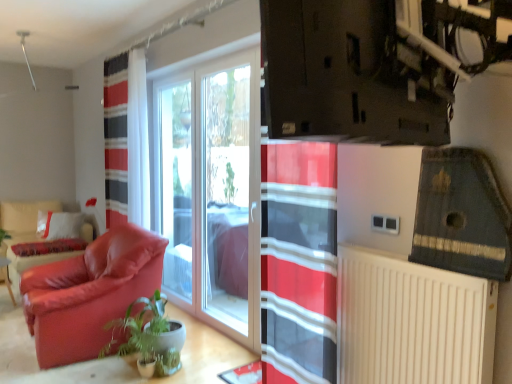
Question: From a real-world perspective, does transparent glass window at center stand above matte leather armchair at left?

Choices:
 (A) yes
 (B) no

Answer: (A)

Question: Considering the relative sizes of transparent glass window at center and matte leather armchair at left in the image provided, is transparent glass window at center thinner than matte leather armchair at left?

Choices:
 (A) no
 (B) yes

Answer: (B)

Question: Can you confirm if transparent glass window at center is wider than matte leather armchair at left?

Choices:
 (A) yes
 (B) no

Answer: (B)

Question: Would you say transparent glass window at center is outside matte leather armchair at left?

Choices:
 (A) yes
 (B) no

Answer: (A)

Question: Considering the relative sizes of transparent glass window at center and matte leather armchair at left in the image provided, is transparent glass window at center bigger than matte leather armchair at left?

Choices:
 (A) no
 (B) yes

Answer: (A)

Question: Is the position of transparent glass window at center more distant than that of matte leather armchair at left?

Choices:
 (A) yes
 (B) no

Answer: (B)

Question: Can you confirm if matte leather armchair at left is bigger than white plastic radiator at lower right?

Choices:
 (A) yes
 (B) no

Answer: (A)

Question: Does matte leather armchair at left touch white plastic radiator at lower right?

Choices:
 (A) yes
 (B) no

Answer: (B)

Question: Considering the relative positions of matte leather armchair at left and white plastic radiator at lower right in the image provided, is matte leather armchair at left behind white plastic radiator at lower right?

Choices:
 (A) no
 (B) yes

Answer: (B)

Question: From a real-world perspective, does matte leather armchair at left stand above white plastic radiator at lower right?

Choices:
 (A) yes
 (B) no

Answer: (B)

Question: Considering the relative positions of matte leather armchair at left and white plastic radiator at lower right in the image provided, is matte leather armchair at left to the right of white plastic radiator at lower right from the viewer's perspective?

Choices:
 (A) no
 (B) yes

Answer: (A)

Question: From the image's perspective, is matte leather armchair at left located above white plastic radiator at lower right?

Choices:
 (A) yes
 (B) no

Answer: (A)

Question: Could you tell me if transparent glass window at center is facing velvet red armchair at left?

Choices:
 (A) no
 (B) yes

Answer: (B)